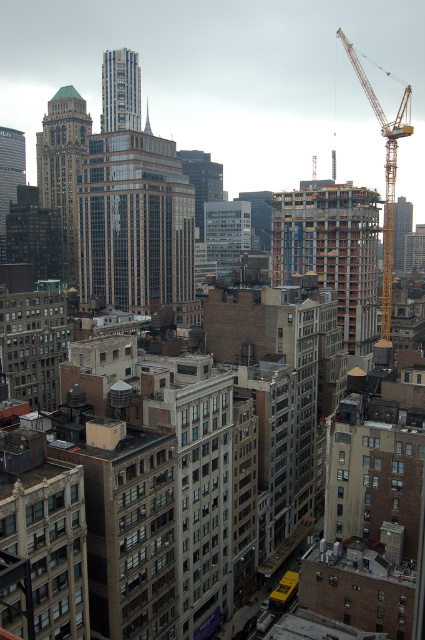
You are standing on the rooftop of a building in the city and looking out. There is a point marked at coordinates (133,224). What object is this point located on?

The point is located on the glassy reflective skyscraper at center.

Looking at this image, you are a delivery drone with a wingspan of 1.2 meters. You need to fly from the red brick construction at center to the yellow metallic crane at right. Is there enough space between them for your drone to pass safely?

The distance between the red brick construction at center and the yellow metallic crane at right is 35.60 meters, which is more than sufficient for a drone with a 1.2 meter wingspan to pass safely between them.

You are a city planner assessing the urban layout. You see the red brick construction at center and the yellow metallic crane at right. Which structure occupies a larger area in the image?

The yellow metallic crane at right is larger than the red brick construction at center, so the yellow metallic crane at right occupies a larger area in the image.